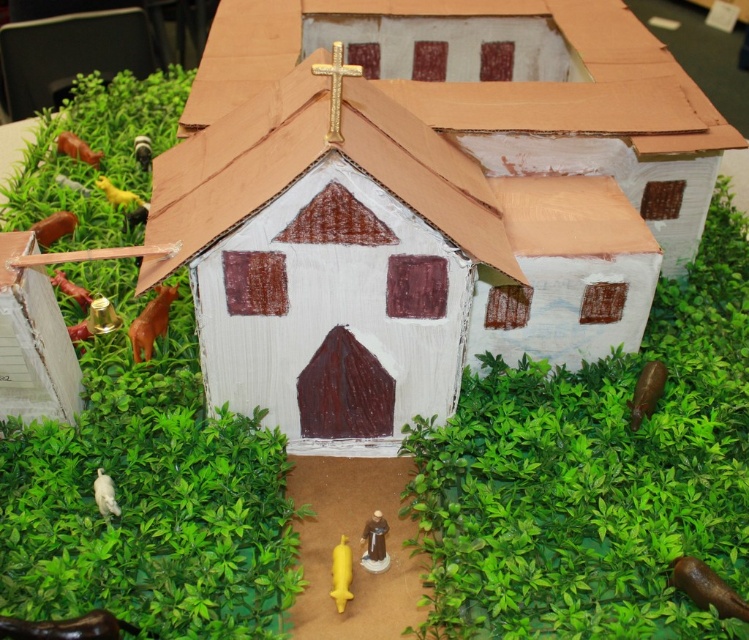
Question: Which point appears farthest from the camera in this image?

Choices:
 (A) (451, 88)
 (B) (97, 468)
 (C) (360, 540)

Answer: (A)

Question: Does white cardboard hut at center appear over matte brown statue at lower center?

Choices:
 (A) no
 (B) yes

Answer: (B)

Question: Is matte brown statue at lower center positioned at the back of white matte bird at lower left?

Choices:
 (A) yes
 (B) no

Answer: (B)

Question: Considering the real-world distances, which object is closest to the matte brown statue at lower center?

Choices:
 (A) white cardboard hut at center
 (B) white matte bird at lower left

Answer: (B)

Question: Based on their relative distances, which object is nearer to the white matte bird at lower left?

Choices:
 (A) white cardboard hut at center
 (B) matte brown statue at lower center

Answer: (B)

Question: Is matte brown statue at lower center above white matte bird at lower left?

Choices:
 (A) no
 (B) yes

Answer: (A)